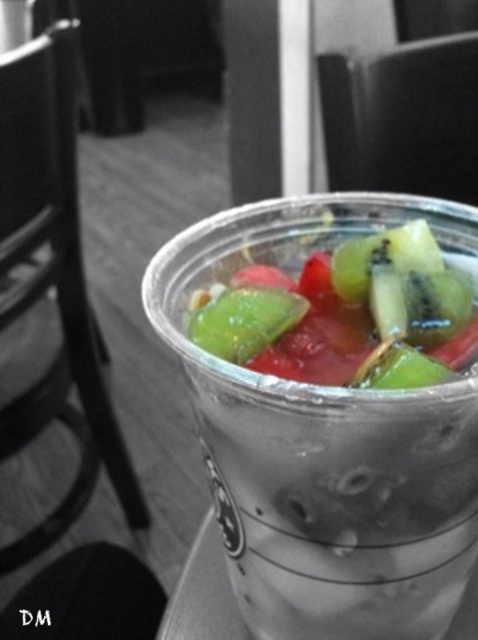
You are holding a transparent plastic cup at center and a translucent plastic fruit salad at center. Which one is positioned to the right?

The transparent plastic cup at center is positioned to the right of the translucent plastic fruit salad at center.

Consider the image. You are holding the plastic cup filled with fruit salad and want to place it on a table. There are two points on the cup where you can place your fingers to lift it. The points are labeled as point (451, 221) and point (226, 355). Which point is closer to you when you are looking at the cup?

Point (451, 221) is further to the viewer than point (226, 355), so the point closer to you is point (226, 355).